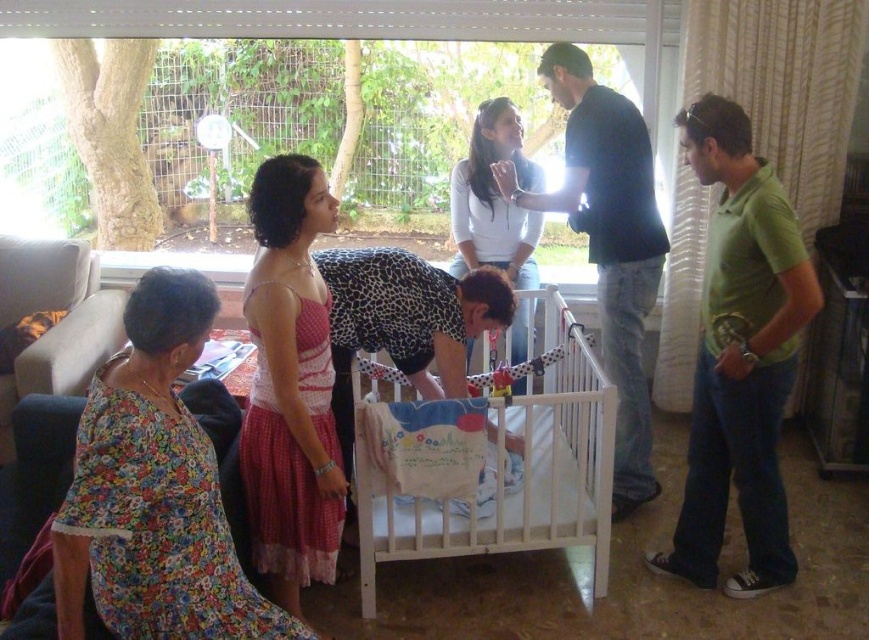
Question: Considering the relative positions of floral print dress at lower left and dark blue shirt at center in the image provided, where is floral print dress at lower left located with respect to dark blue shirt at center?

Choices:
 (A) above
 (B) below

Answer: (B)

Question: Does pink polka dot dress at center have a smaller size compared to white wooden crib at center?

Choices:
 (A) yes
 (B) no

Answer: (A)

Question: Which of the following is the farthest from the observer?

Choices:
 (A) (481, 262)
 (B) (620, 426)
 (C) (369, 572)

Answer: (A)

Question: Does dark blue shirt at center appear on the right side of white matte shirt at upper center?

Choices:
 (A) yes
 (B) no

Answer: (A)

Question: Which object is farther from the camera taking this photo?

Choices:
 (A) floral print dress at lower left
 (B) pink polka dot dress at center

Answer: (B)

Question: Estimate the real-world distances between objects in this image. Which object is closer to the white matte shirt at upper center?

Choices:
 (A) floral print dress at lower left
 (B) pink polka dot dress at center
 (C) white wooden crib at center

Answer: (C)